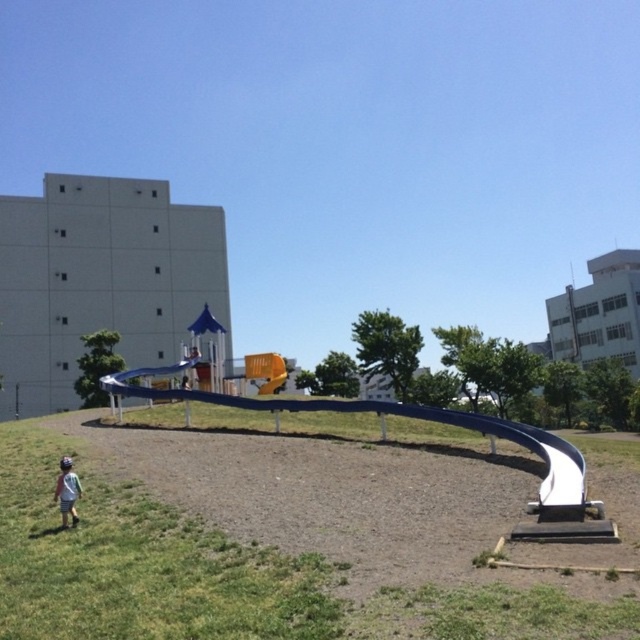
You are a parent supervising a child at the playground. You notice the green grass at lower left and the blue rubber slide at center. Which area would be safer for the child to play on if they want to avoid tripping?

The blue rubber slide at center is safer for the child to play on because the green grass at lower left is shorter, which might not provide enough cushioning, whereas the slide is designed for play and has a rubber surface.

You are standing at the point marked by the coordinates point (250, 564) in the playground scene. Looking towards the slide structure, which direction should you walk to reach the slide?

The point (250, 564) indicates green grass at lower left. Since the slide is in the foreground and the point is at the lower left, you should walk towards the upper right direction to reach the slide.

You are a parent watching your child play in the playground. Your child is wearing light blue denim shorts at lower left and is about to climb onto the blue rubber slide at center. Based on the slide and the shorts, which item is wider?

The blue rubber slide at center is wider than the light blue denim shorts at lower left.